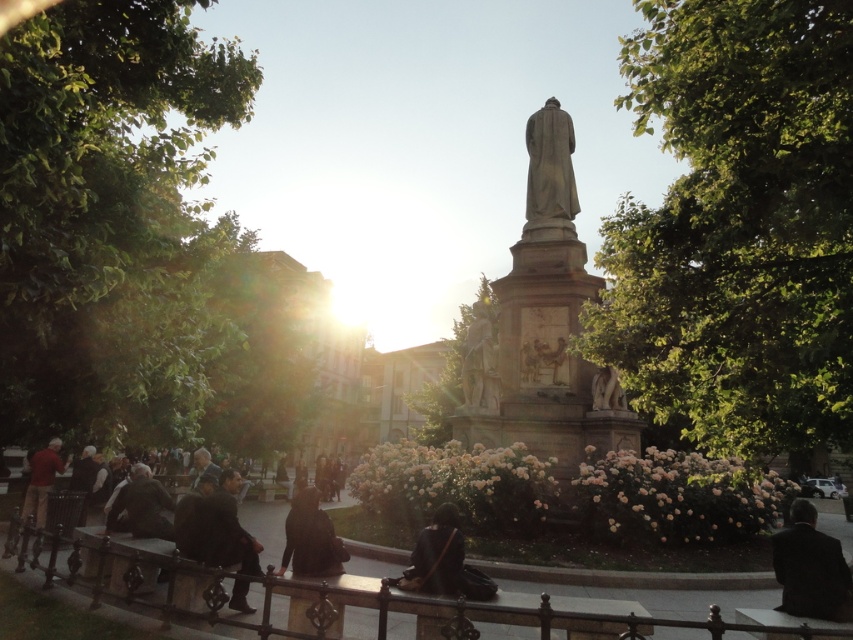
Question: Does dark matte jacket at lower center come in front of polished bronze statue at center?

Choices:
 (A) no
 (B) yes

Answer: (B)

Question: Which object is farther from the camera taking this photo?

Choices:
 (A) dark suit at lower right
 (B) dark brown suit at lower left
 (C) dark fabric coat at center
 (D) dark matte jacket at lower center

Answer: (C)

Question: From the image, what is the correct spatial relationship of dark suit at lower right in relation to dark matte jacket at lower center?

Choices:
 (A) right
 (B) left

Answer: (A)

Question: Which is nearer to the dark fabric coat at center?

Choices:
 (A) white marble lion at lower center
 (B) dark matte jacket at lower center
 (C) red sweater at left

Answer: (B)

Question: Among these objects, which one is nearest to the camera?

Choices:
 (A) red sweater at left
 (B) dark matte jacket at lower center
 (C) dark fabric coat at center

Answer: (B)

Question: Is dark gray stone statue at center smaller than dark matte jacket at lower center?

Choices:
 (A) no
 (B) yes

Answer: (A)